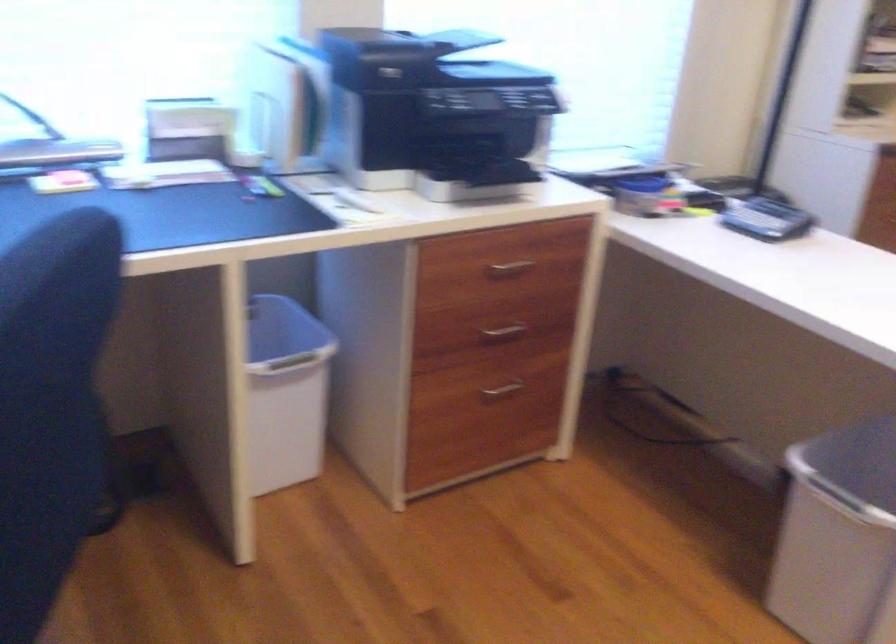
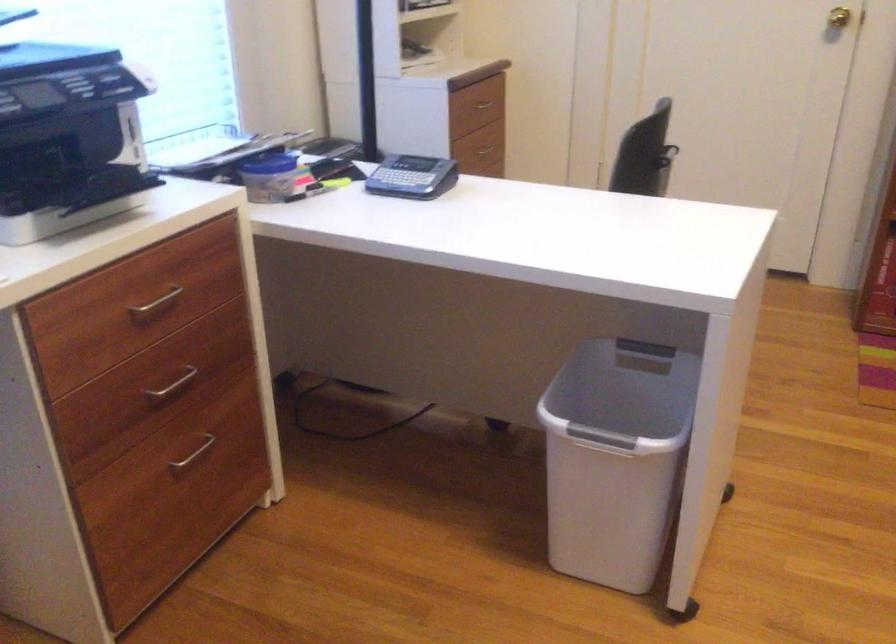
Find the pixel in the second image that matches point 640,184 in the first image.

(270, 164)